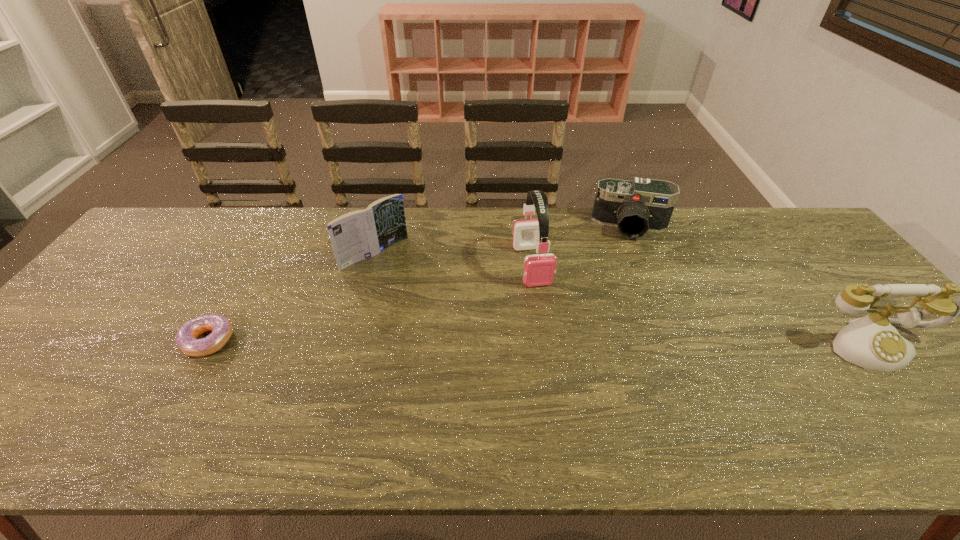
Where is `free region located on the front cover of the fourth object from right to left`? This screenshot has width=960, height=540. free region located on the front cover of the fourth object from right to left is located at coordinates (401, 276).

You are a GUI agent. You are given a task and a screenshot of the screen. Output one action in this format:
    pyautogui.click(x=<x>, y=<y>)
    Task: Click on the vacant space located on the front cover of the fourth object from right to left
    This screenshot has height=540, width=960.
    Given the screenshot: What is the action you would take?
    pyautogui.click(x=410, y=284)

Where is `free space located 0.120m on the front cover of the fourth object from right to left`? free space located 0.120m on the front cover of the fourth object from right to left is located at coordinates [416, 289].

Find the location of a particular element. The image size is (960, 540). vacant space located 0.090m on the outer surface of the earphone is located at coordinates (545, 312).

At what (x,y) coordinates should I click in order to perform the action: click on vacant space situated 0.350m on the outer surface of the earphone. Please return your answer as a coordinate pair (x, y). The image size is (960, 540). Looking at the image, I should click on click(572, 398).

Where is `vacant space situated 0.340m on the outer surface of the earphone`? The width and height of the screenshot is (960, 540). vacant space situated 0.340m on the outer surface of the earphone is located at coordinates (570, 394).

Where is `free space located on the front-facing side of the fourth tallest object`? This screenshot has height=540, width=960. free space located on the front-facing side of the fourth tallest object is located at coordinates (628, 265).

Find the location of `free space located on the front-facing side of the fourth tallest object`. free space located on the front-facing side of the fourth tallest object is located at coordinates (628, 336).

What are the coordinates of `vacant space located 0.130m on the front-facing side of the fourth tallest object` in the screenshot? It's located at (628, 269).

Locate an element on the screen. The width and height of the screenshot is (960, 540). book that is at the far edge is located at coordinates (361, 234).